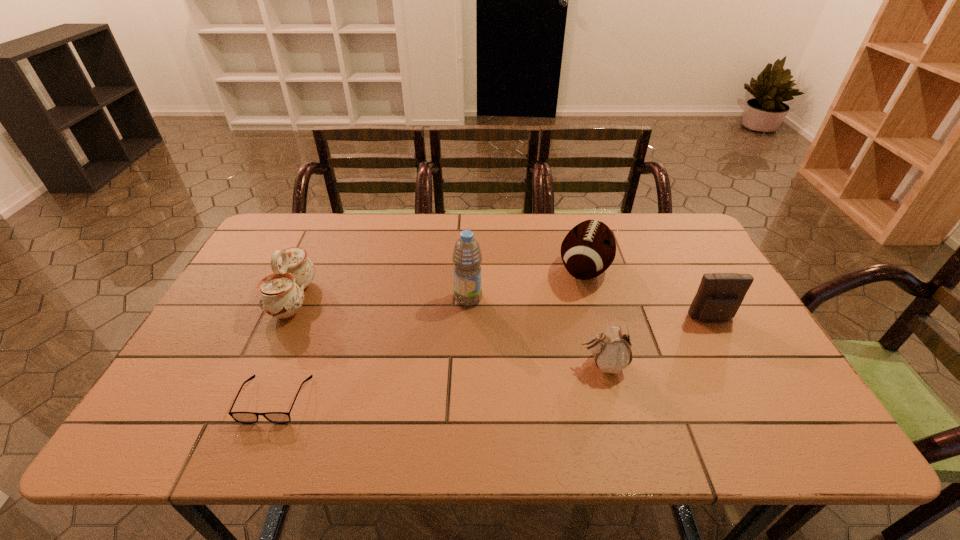
Where is `water bottle`? The width and height of the screenshot is (960, 540). water bottle is located at coordinates pyautogui.click(x=467, y=257).

Locate an element on the screen. The width and height of the screenshot is (960, 540). the tallest object is located at coordinates (467, 257).

Locate an element on the screen. This screenshot has width=960, height=540. chinaware is located at coordinates (281, 294).

In order to click on football (American) in this screenshot , I will do `click(589, 248)`.

At what (x,y) coordinates should I click in order to perform the action: click on the right pouch. Please return your answer as a coordinate pair (x, y). This screenshot has width=960, height=540. Looking at the image, I should click on (719, 296).

This screenshot has height=540, width=960. In order to click on the farther pouch in this screenshot , I will do `click(719, 296)`.

Locate an element on the screen. The image size is (960, 540). the left pouch is located at coordinates (611, 349).

Identify the location of the shortest object. [x=241, y=417].

This screenshot has width=960, height=540. Find the location of `vacant space located 0.100m on the left of the fourth object from right to left`. vacant space located 0.100m on the left of the fourth object from right to left is located at coordinates (419, 299).

Where is `vacant space located by the handle of the chinaware`? This screenshot has height=540, width=960. vacant space located by the handle of the chinaware is located at coordinates (405, 299).